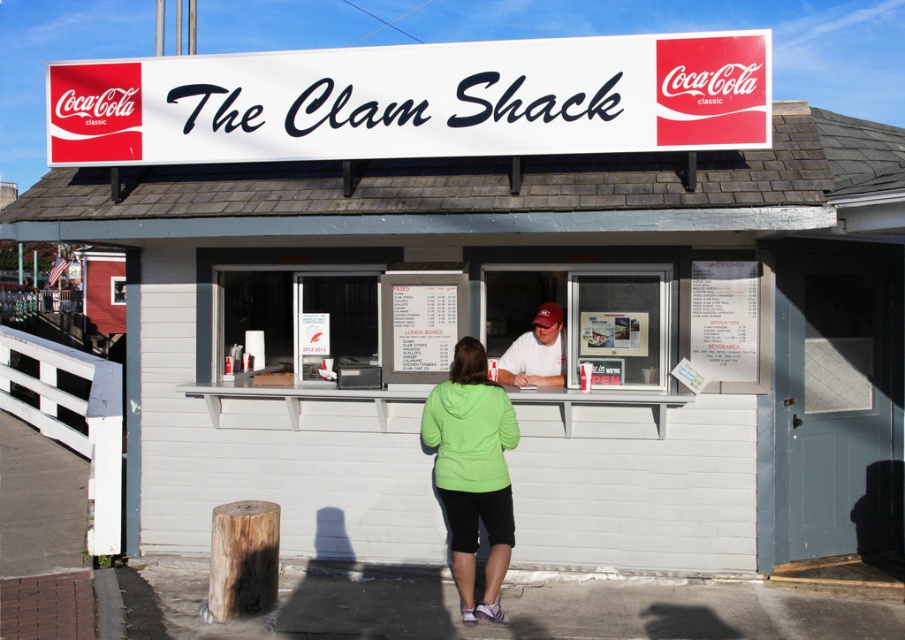
You are a customer at The Clam Shack food stand and you want to buy a shirt. You see a green matte hoodie at center and a matte white shirt at center. Which one is bigger in size?

The green matte hoodie at center is larger in size than the matte white shirt at center.

You are a customer at The Clam Shack food stand and you want to place both the green matte hoodie at center and the matte white shirt at center on a shelf that can only hold items within 3 feet of each other. Will they fit together on the shelf?

The green matte hoodie at center and the matte white shirt at center are 3.52 feet apart from each other, which exceeds the 3 feet limit of the shelf. Therefore, they cannot fit together on the shelf.

You are a customer at The Clam Shack food stand and you want to buy a shirt. You see the green matte hoodie at center and the matte white shirt at center. Which one is taller?

The green matte hoodie at center is taller than the matte white shirt at center.